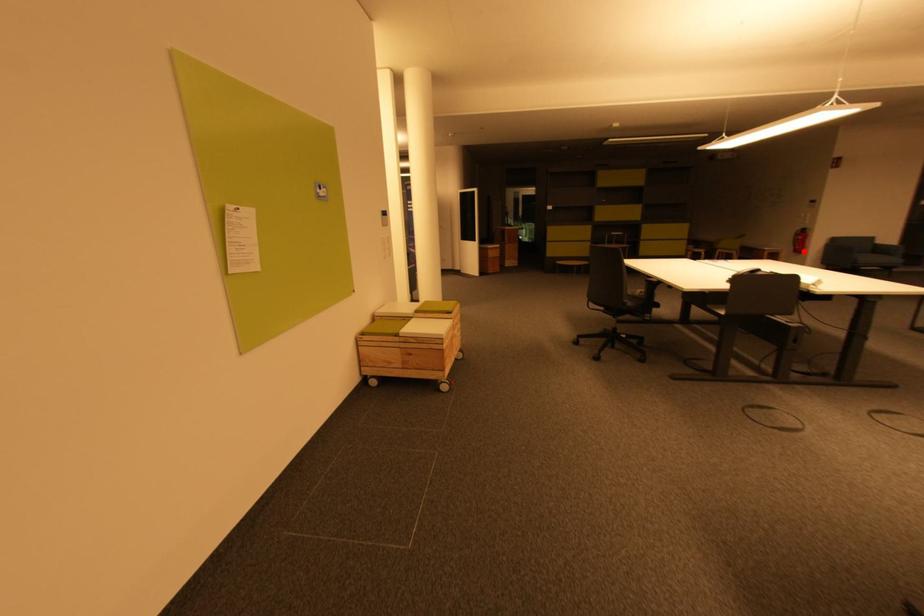
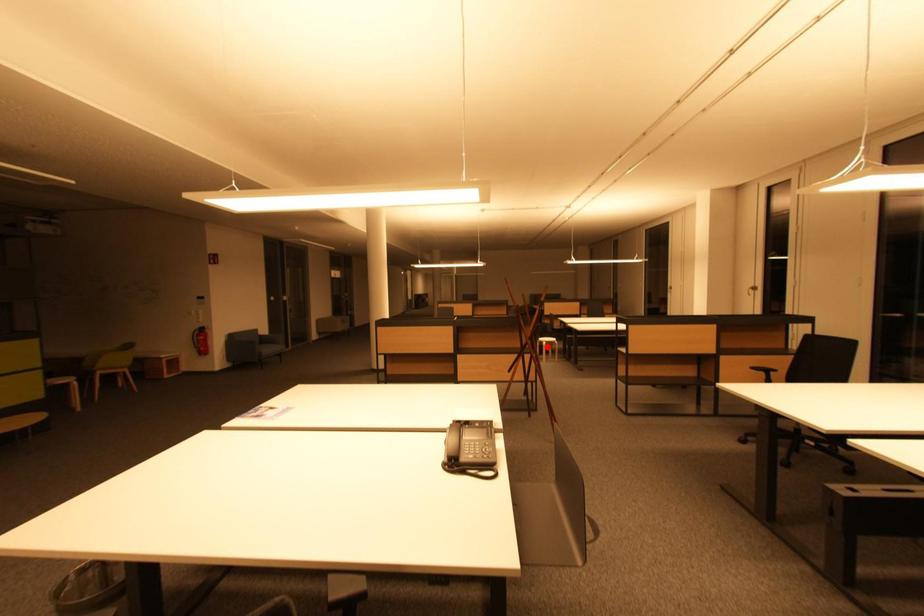
I am providing you with two images of the same scene from different viewpoints. A red point is marked on the first image and another point is marked on the second image. Is the marked point in image1 the same physical position as the marked point in image2?

No